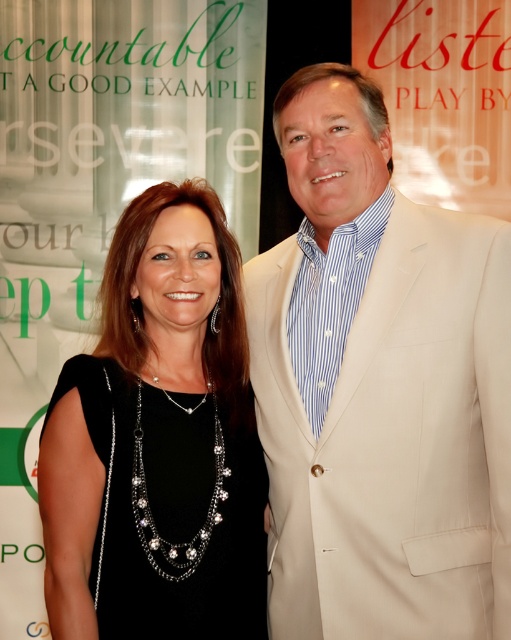
Does beige textured suit at right have a lesser height compared to black satin dress at center?

Incorrect, beige textured suit at right's height does not fall short of black satin dress at center's.

Is the position of beige textured suit at right more distant than that of black satin dress at center?

No, beige textured suit at right is closer to the viewer.

Who is more distant from viewer, [458,556] or [160,326]?

Point [160,326]

Where is `beige textured suit at right`? beige textured suit at right is located at coordinates (380, 390).